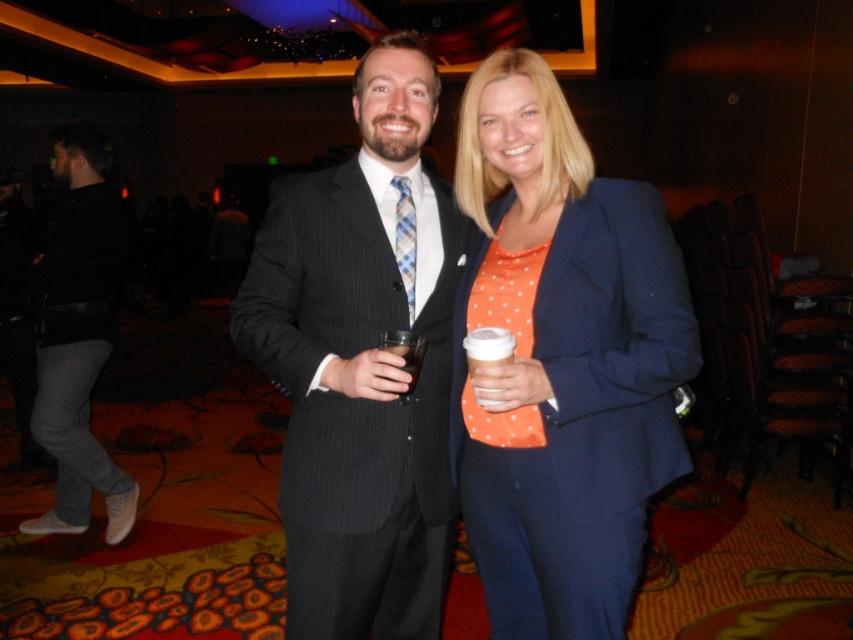
You are standing at the point marked by the coordinates point (363, 362) in the image. Looking around, you see the matte black suit at center. Which direction should you face to see the person on the left in the dark pinstripe suit?

The person on the left in the dark pinstripe suit is to the left of the matte black suit at center. Since you are at point (363, 362), facing the direction towards the left of the matte black suit at center will allow you to see the person on the left in the dark pinstripe suit.

Looking at this image, you are at a conference and need to grab your drink quickly. You see the matte black suit at center and the white paper cup at center. Which object is closer to you if you are facing the scene?

The matte black suit at center is closer to you because the white paper cup at center is behind it.